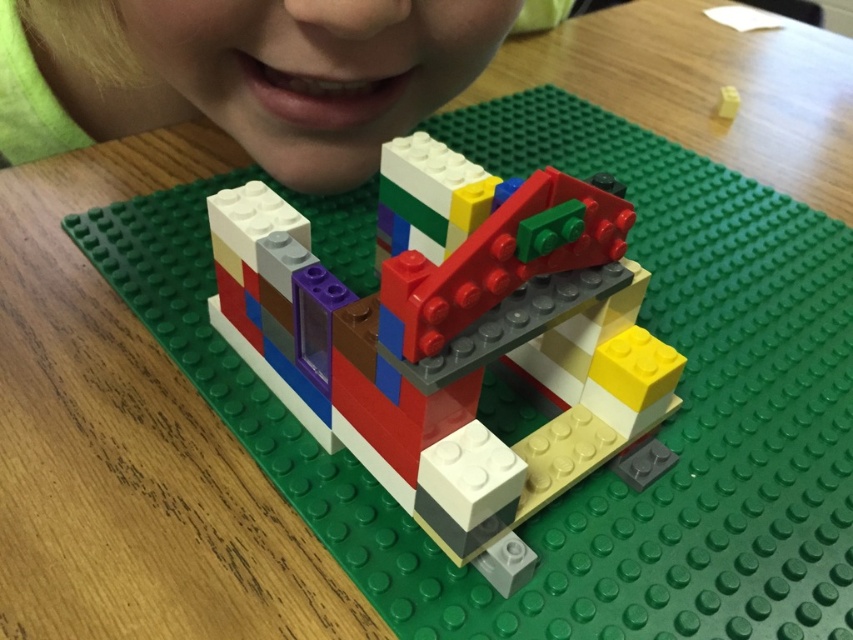
Question: Can you confirm if multicolored plastic building block at center is positioned above matte green lego brick at upper center?

Choices:
 (A) no
 (B) yes

Answer: (A)

Question: Is multicolored plastic building block at center behind matte green lego brick at upper center?

Choices:
 (A) no
 (B) yes

Answer: (A)

Question: Which point is closer to the camera?

Choices:
 (A) tap(440, 532)
 (B) tap(256, 51)

Answer: (A)

Question: Does multicolored plastic building block at center appear on the left side of matte green lego brick at upper center?

Choices:
 (A) no
 (B) yes

Answer: (A)